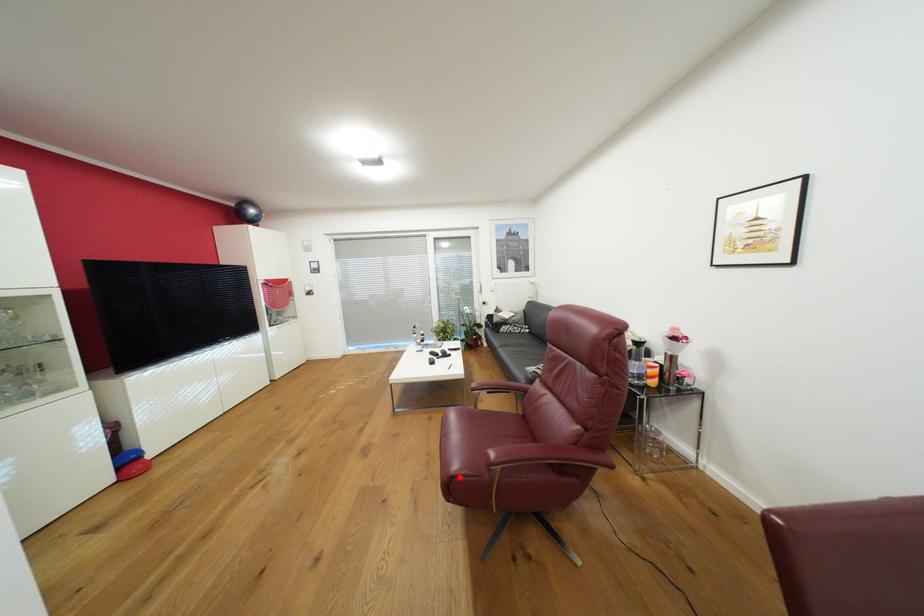
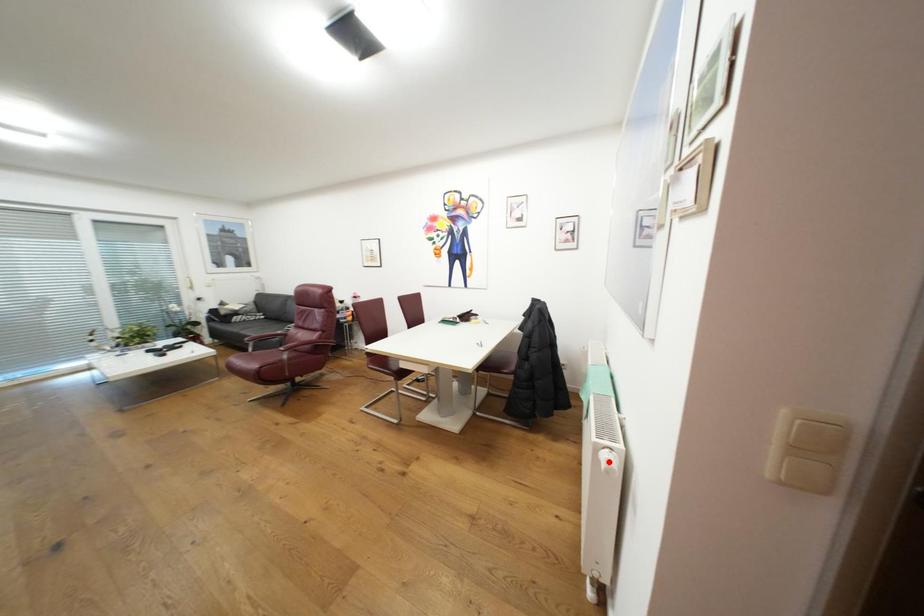
I am providing you with two images of the same scene from different viewpoints. A red point is marked on the first image and another point is marked on the second image. Do the highlighted points in image1 and image2 indicate the same real-world spot?

No